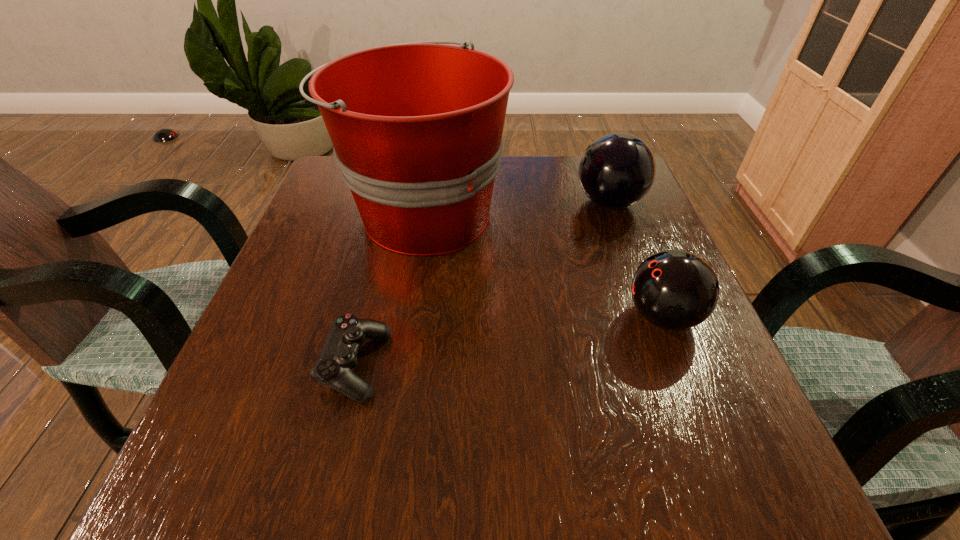
The height and width of the screenshot is (540, 960). What are the coordinates of `bucket` in the screenshot? It's located at (417, 127).

Where is `the taller bowling ball`? The width and height of the screenshot is (960, 540). the taller bowling ball is located at coordinates (617, 170).

Locate an element on the screen. The height and width of the screenshot is (540, 960). the second tallest object is located at coordinates (x=617, y=170).

Locate an element on the screen. The width and height of the screenshot is (960, 540). the second shortest object is located at coordinates (674, 289).

This screenshot has height=540, width=960. In order to click on the shorter bowling ball in this screenshot , I will do `click(674, 289)`.

Locate an element on the screen. This screenshot has width=960, height=540. the shortest object is located at coordinates [x=338, y=357].

This screenshot has width=960, height=540. I want to click on free spot located on the right of the tallest object, so click(x=645, y=213).

The image size is (960, 540). Identify the location of vacant space located on the side of the taller bowling ball with the finger holes. click(x=441, y=202).

The width and height of the screenshot is (960, 540). What are the coordinates of `vacant area situated 0.390m on the side of the taller bowling ball with the finger holes` in the screenshot? It's located at 406,202.

The width and height of the screenshot is (960, 540). I want to click on vacant space positioned on the side of the taller bowling ball with the finger holes, so click(x=419, y=202).